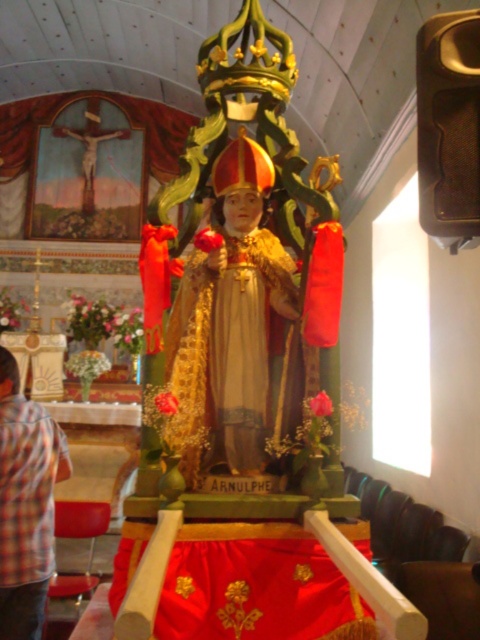
Question: Does gold textured statue at center have a larger size compared to plaid shirt at lower left?

Choices:
 (A) no
 (B) yes

Answer: (B)

Question: Which point appears closest to the camera in this image?

Choices:
 (A) (3, 618)
 (B) (197, 264)

Answer: (B)

Question: Does gold textured statue at center have a larger size compared to plaid shirt at lower left?

Choices:
 (A) no
 (B) yes

Answer: (B)

Question: Considering the relative positions of gold textured statue at center and plaid shirt at lower left in the image provided, where is gold textured statue at center located with respect to plaid shirt at lower left?

Choices:
 (A) below
 (B) above

Answer: (B)

Question: Which point is farther from the camera taking this photo?

Choices:
 (A) (218, 452)
 (B) (46, 449)

Answer: (B)

Question: Among these objects, which one is farthest from the camera?

Choices:
 (A) gold textured statue at center
 (B) plaid shirt at lower left

Answer: (B)